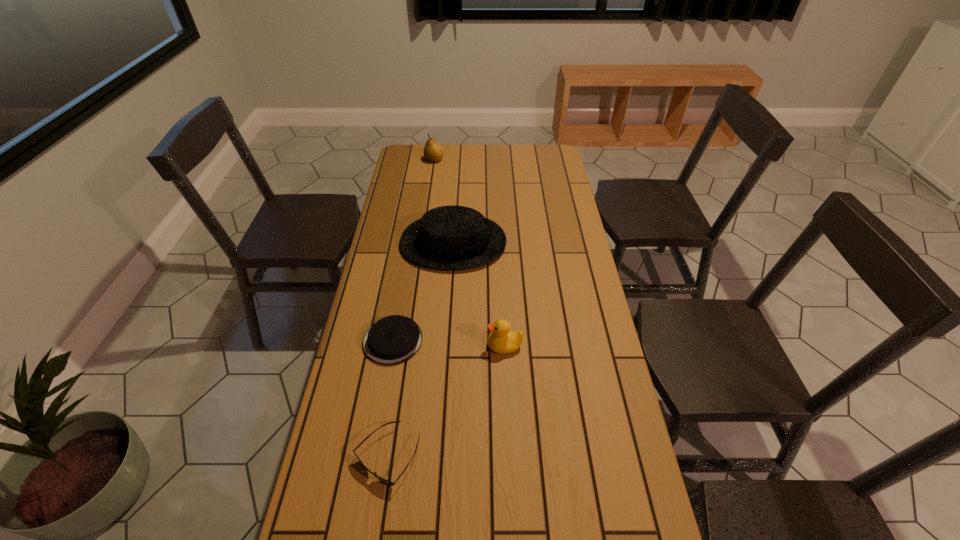
Locate an element on the screen. This screenshot has height=540, width=960. free space located 0.340m at the beak of the duck is located at coordinates (372, 346).

The image size is (960, 540). I want to click on vacant space located on the right of the pancake, so click(x=529, y=341).

Find the location of `vacant space located 0.050m at the front of the nearest object showing the lenses`. vacant space located 0.050m at the front of the nearest object showing the lenses is located at coordinates (379, 514).

I want to click on object that is at the far edge, so click(x=433, y=152).

Where is `pear that is at the left edge`? The width and height of the screenshot is (960, 540). pear that is at the left edge is located at coordinates (433, 152).

This screenshot has height=540, width=960. Identify the location of fedora present at the left edge. (452, 237).

Locate an element on the screen. This screenshot has height=540, width=960. pancake that is at the left edge is located at coordinates (393, 339).

Locate an element on the screen. This screenshot has height=540, width=960. sunglasses that is at the left edge is located at coordinates (381, 479).

Where is `object that is at the far left corner`? The width and height of the screenshot is (960, 540). object that is at the far left corner is located at coordinates (433, 152).

Image resolution: width=960 pixels, height=540 pixels. In the image, there is a desktop. Find the location of `vacant space at the far edge`. vacant space at the far edge is located at coordinates (525, 156).